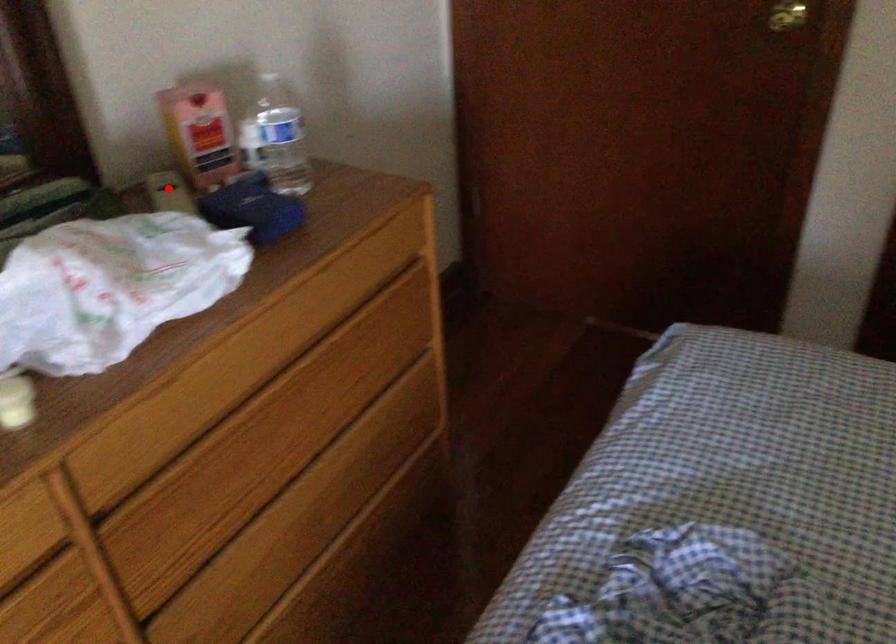
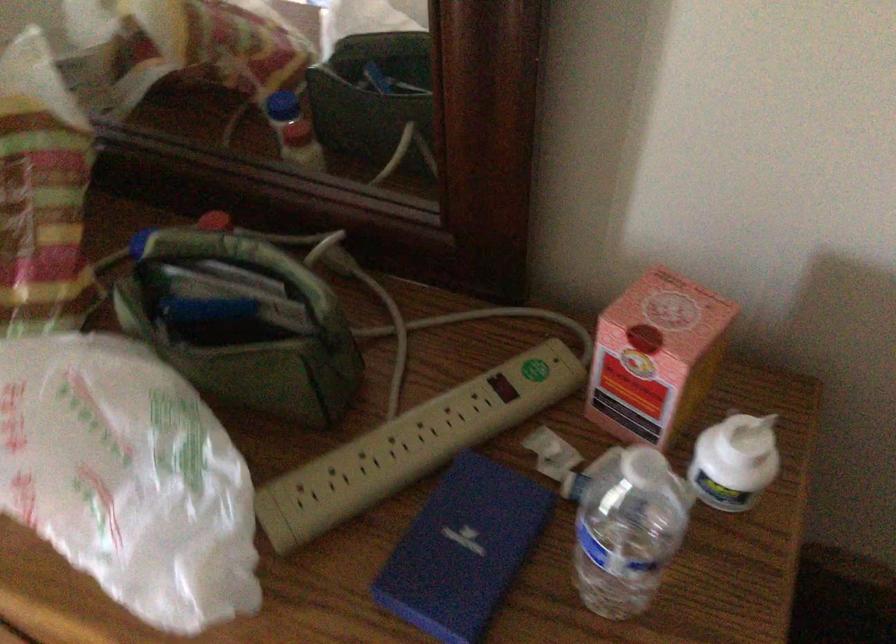
Question: I am providing you with two images of the same scene from different viewpoints. In image1, a red point is highlighted. Considering the same 3D point in image2, which of the following is correct?

Choices:
 (A) It is closer
 (B) It is farther

Answer: (A)